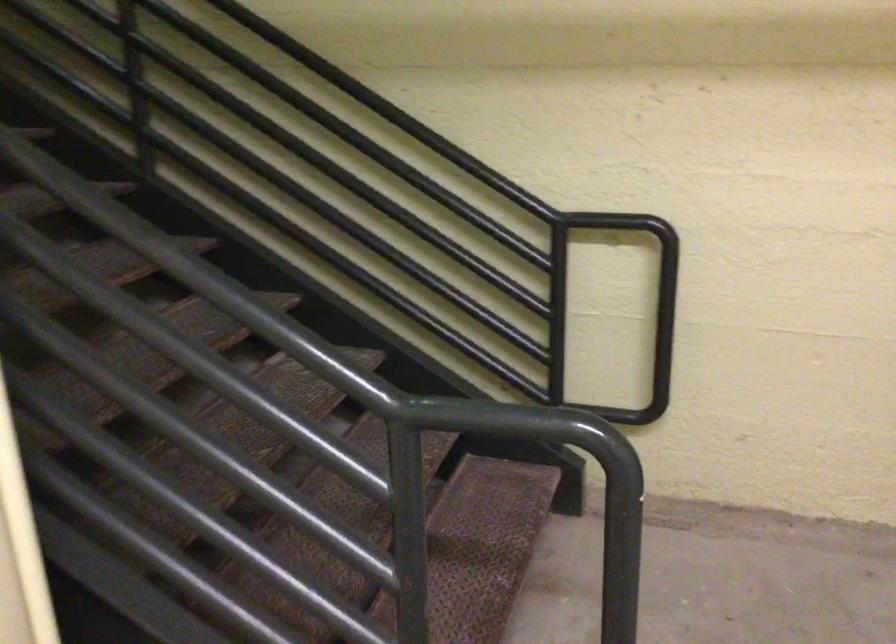
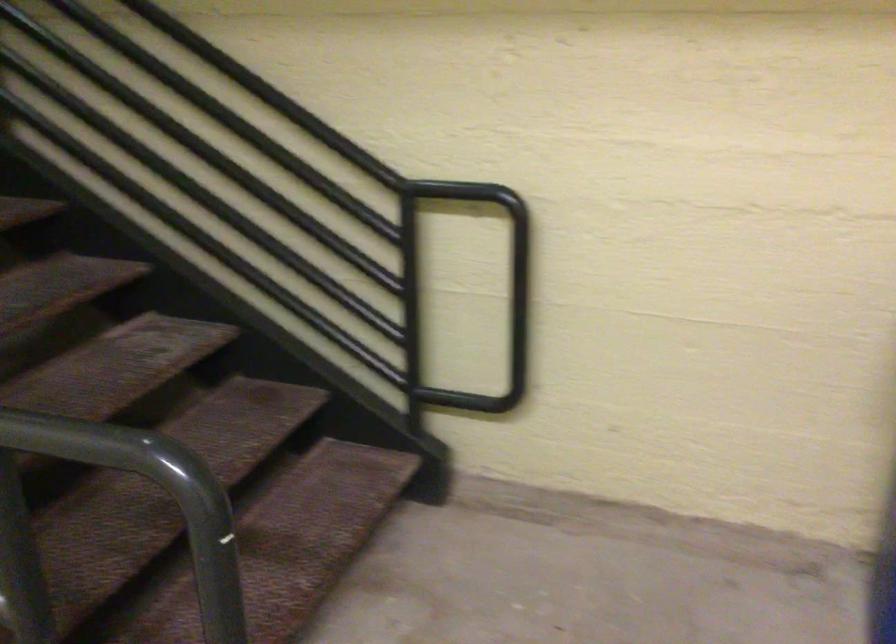
In the second image, find the point that corresponds to (x=633, y=316) in the first image.

(495, 301)